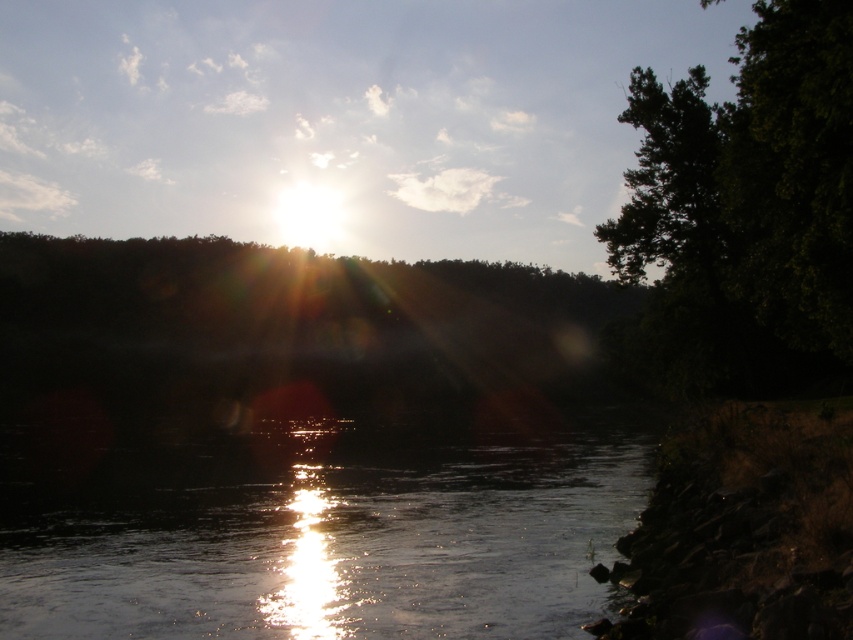
Question: Which point is closer to the camera?

Choices:
 (A) green leafy tree at right
 (B) glistening water at center

Answer: (B)

Question: In this image, where is glistening water at center located relative to green leafy tree at right?

Choices:
 (A) right
 (B) left

Answer: (B)

Question: Which point is closer to the camera?

Choices:
 (A) (831, 224)
 (B) (402, 502)

Answer: (A)

Question: Is glistening water at center above green leafy tree at right?

Choices:
 (A) yes
 (B) no

Answer: (B)

Question: From the image, what is the correct spatial relationship of glistening water at center in relation to green leafy tree at right?

Choices:
 (A) left
 (B) right

Answer: (A)

Question: Which object is closer to the camera taking this photo?

Choices:
 (A) green leafy tree at right
 (B) glistening water at center

Answer: (B)